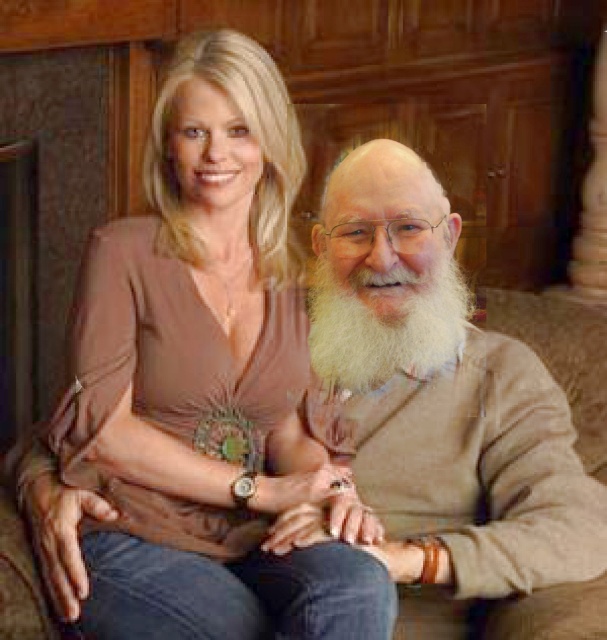
Question: Which of the following is the closest to the observer?

Choices:
 (A) matte brown blouse at center
 (B) white beard at center
 (C) brown fabric couch at center
 (D) white fluffy beard at center

Answer: (A)

Question: Which object appears closest to the camera in this image?

Choices:
 (A) white fluffy beard at center
 (B) brown fabric couch at center
 (C) white beard at center

Answer: (C)

Question: Is matte brown blouse at center below white fluffy beard at center?

Choices:
 (A) no
 (B) yes

Answer: (B)

Question: Is matte brown blouse at center behind white beard at center?

Choices:
 (A) no
 (B) yes

Answer: (A)

Question: Based on their relative distances, which object is farther from the matte brown blouse at center?

Choices:
 (A) white beard at center
 (B) white fluffy beard at center
 (C) brown fabric couch at center

Answer: (C)

Question: Can you confirm if white beard at center is wider than brown fabric couch at center?

Choices:
 (A) no
 (B) yes

Answer: (B)